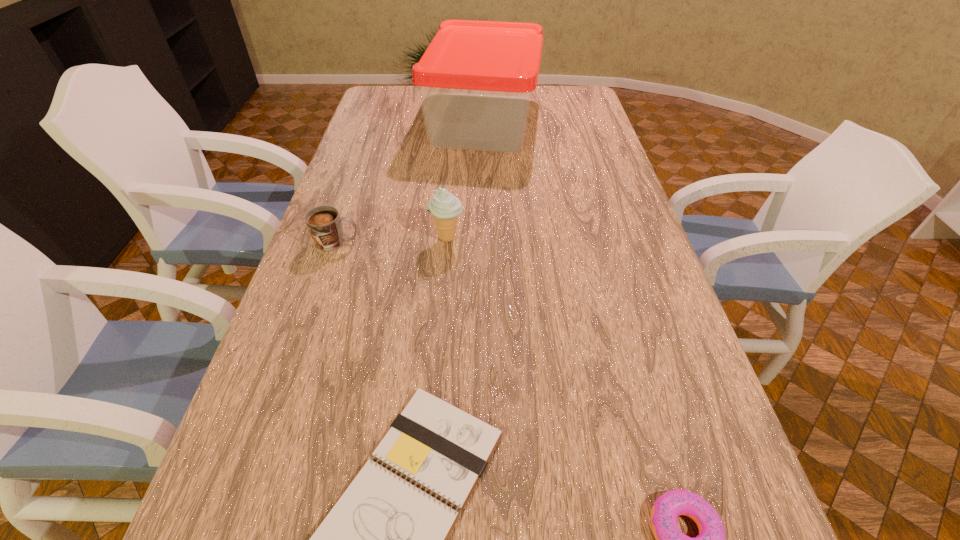
At what (x,y) coordinates should I click in order to perform the action: click on vacant space at the left edge of the desktop. Please return your answer as a coordinate pair (x, y). Looking at the image, I should click on (258, 511).

Locate an element on the screen. vacant space at the right edge of the desktop is located at coordinates (668, 414).

Locate an element on the screen. The width and height of the screenshot is (960, 540). free spot at the far left corner of the desktop is located at coordinates (403, 97).

Locate an element on the screen. The width and height of the screenshot is (960, 540). vacant space at the far right corner is located at coordinates (553, 106).

Identify the location of vacant region between the tray and the second tallest object. This screenshot has height=540, width=960. (465, 180).

Find the location of a particular element. empty location between the third shortest object and the icecream is located at coordinates (392, 240).

The height and width of the screenshot is (540, 960). In order to click on unoccupied position between the fourth shortest object and the farthest object in this screenshot , I will do `click(465, 180)`.

At what (x,y) coordinates should I click in order to perform the action: click on blank region between the third shortest object and the tray. Please return your answer as a coordinate pair (x, y). This screenshot has width=960, height=540. Looking at the image, I should click on (410, 182).

Identify which object is located as the nearest to the mug. Please provide its 2D coordinates. Your answer should be formatted as a tuple, i.e. [(x, y)], where the tuple contains the x and y coordinates of a point satisfying the conditions above.

[(445, 207)]

The image size is (960, 540). I want to click on object that is the closest to the second tallest object, so click(x=324, y=223).